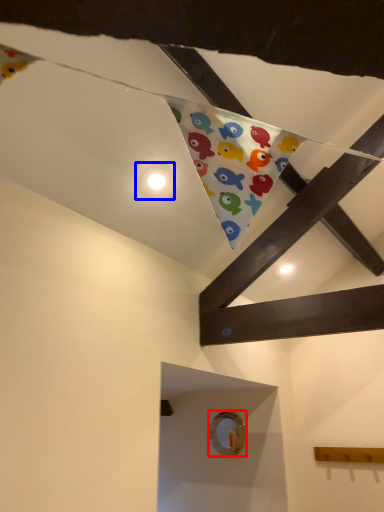
Question: Among these objects, which one is farthest to the camera, button (highlighted by a red box) or button (highlighted by a blue box)?

Choices:
 (A) button
 (B) button

Answer: (A)